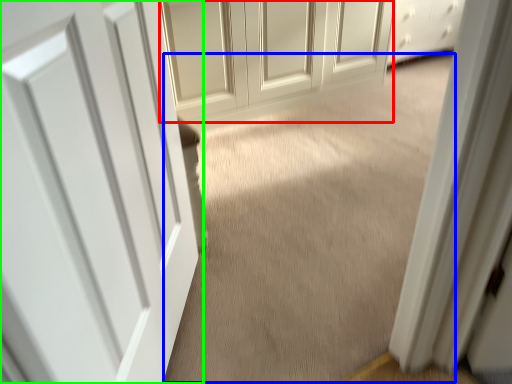
Question: Which object is the farthest from door (highlighted by a red box)? Choose among these: plain (highlighted by a blue box) or door (highlighted by a green box).

Choices:
 (A) plain
 (B) door

Answer: (B)